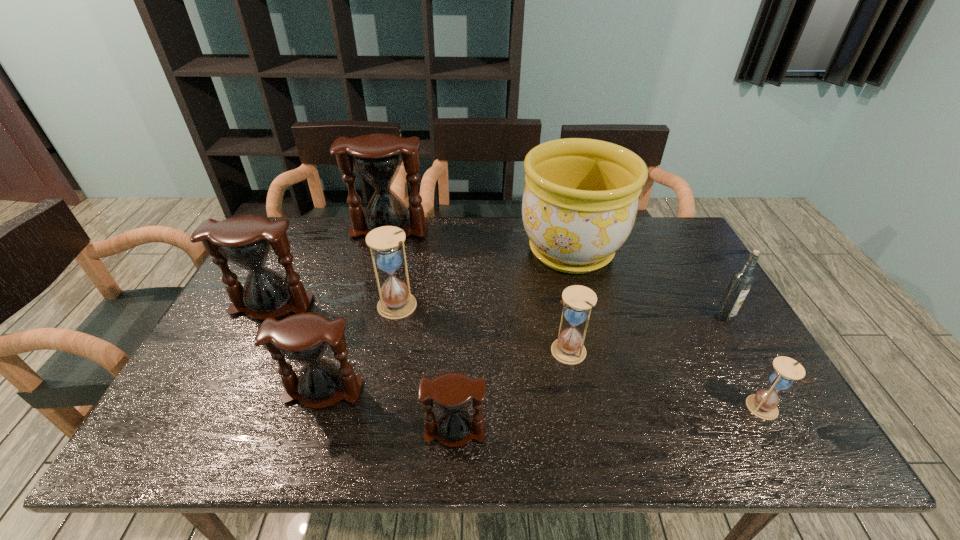
Choose which white hourglass is the nearest neighbor to the rightmost hourglass. Please provide its 2D coordinates. Your answer should be formatted as a tuple, i.e. [(x, y)], where the tuple contains the x and y coordinates of a point satisfying the conditions above.

[(578, 300)]

Where is `free space that satisfies the following two spatial constraints: 1. on the back side of the third farthest brown hourglass; 2. on the left side of the leftmost white hourglass`? The width and height of the screenshot is (960, 540). free space that satisfies the following two spatial constraints: 1. on the back side of the third farthest brown hourglass; 2. on the left side of the leftmost white hourglass is located at coordinates (350, 306).

Image resolution: width=960 pixels, height=540 pixels. I want to click on vacant area in the image that satisfies the following two spatial constraints: 1. on the front side of the second farthest brown hourglass; 2. on the left side of the fourth farthest hourglass, so click(250, 350).